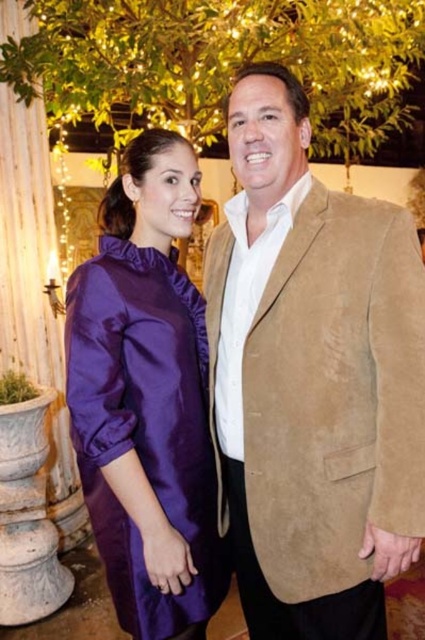
Does suede jacket at center have a smaller size compared to purple satin dress at center?

Incorrect, suede jacket at center is not smaller in size than purple satin dress at center.

This screenshot has height=640, width=425. What do you see at coordinates (312, 378) in the screenshot?
I see `suede jacket at center` at bounding box center [312, 378].

Image resolution: width=425 pixels, height=640 pixels. I want to click on suede jacket at center, so click(x=312, y=378).